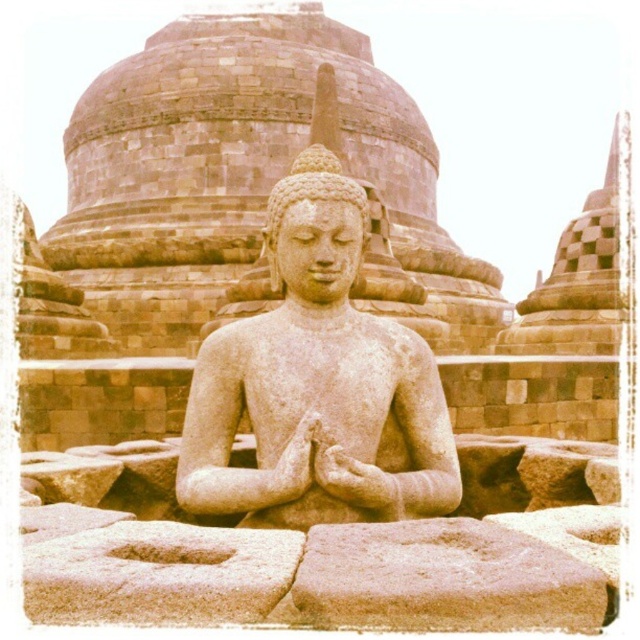
Does smooth stone statue at center have a larger size compared to smooth sandstone at center?

Yes.

Is point (280, 317) positioned before point (444, 538)?

No, it is not.

The height and width of the screenshot is (640, 640). Identify the location of smooth stone statue at center. (317, 384).